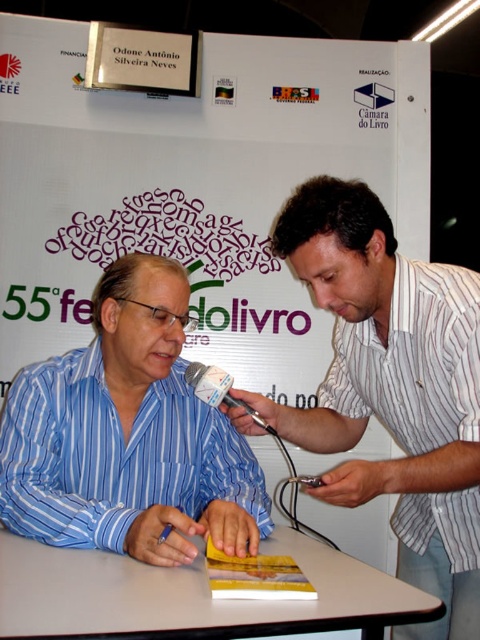
You are a photographer standing at the back of the event venue. You want to take a photo of the man in the white striped shirt at center and the man in the blue striped shirt at left. How far apart are they in inches?

The man in the white striped shirt at center and the man in the blue striped shirt at left are 38.82 inches apart.

In the scene shown: You are a photographer at the book fair and want to capture both the blue striped shirt at center and the white striped shirt at right in a single frame. Considering their sizes, which one should you position closer to the camera to ensure both appear equally sized in the photo?

To make both the blue striped shirt at center and the white striped shirt at right appear equally sized in the photo, position the smaller white striped shirt at right closer to the camera since the blue striped shirt at center is larger in size.

Consider the image. You are standing at the origin point of the coordinate system in the image. Where is the blue striped shirt at center located in terms of coordinates?

The blue striped shirt at center is located at coordinates approximately at point (x=128, y=435).